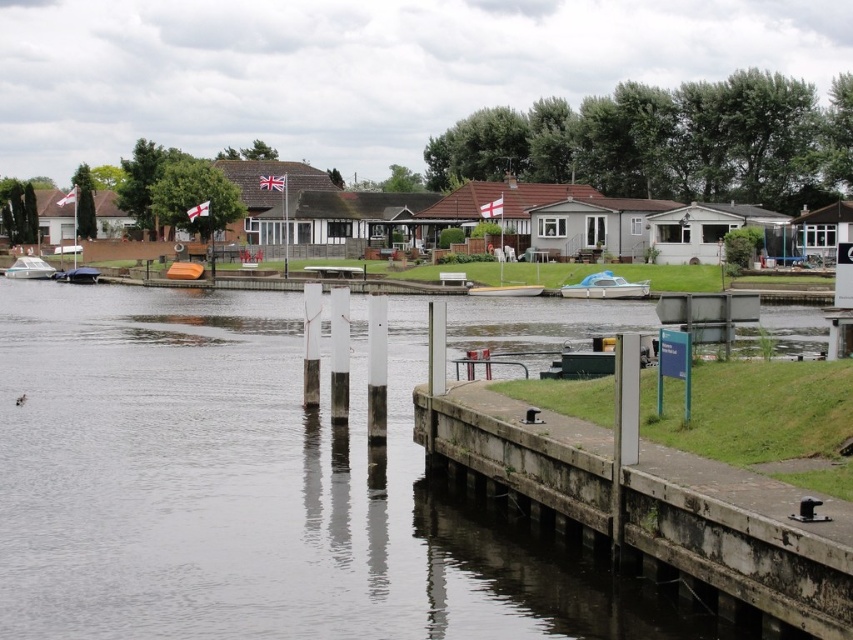
You are standing on the concrete walkway and see the white plastic boat at center and the matte black boat at lower left. Which boat is closer to the wooden posts protruding from the water?

The matte black boat at lower left is closer to the wooden posts protruding from the water because it is positioned to the left of the white plastic boat at center, which is further right.

You are standing at the riverside and want to determine which of the two points, point (756, 477) or point (492, 289), is closer to you. Based on the scene description, which point is nearer?

Point (756, 477) is closer to the viewer than point (492, 289).